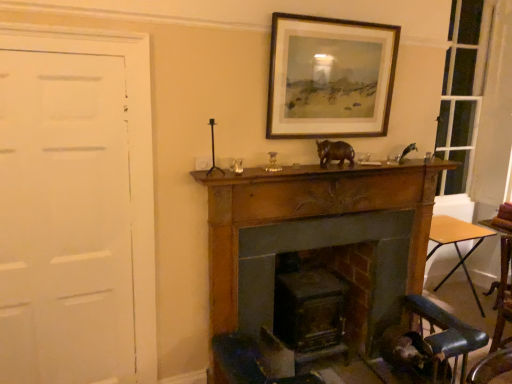
Question: Is white matte door at left with dark gray stone fireplace at center, acting as the first fireplace starting from the back?

Choices:
 (A) no
 (B) yes

Answer: (A)

Question: From the image's perspective, is white matte door at left over dark gray stone fireplace at center, acting as the first fireplace starting from the back?

Choices:
 (A) no
 (B) yes

Answer: (B)

Question: Is white matte door at left smaller than dark gray stone fireplace at center, which is the 2th fireplace from front to back?

Choices:
 (A) yes
 (B) no

Answer: (A)

Question: Is white matte door at left far away from dark gray stone fireplace at center, which is the 2th fireplace from front to back?

Choices:
 (A) yes
 (B) no

Answer: (A)

Question: Does white matte door at left have a greater height compared to dark gray stone fireplace at center, acting as the first fireplace starting from the back?

Choices:
 (A) no
 (B) yes

Answer: (B)

Question: From a real-world perspective, relative to dark gray stone fireplace at center, acting as the first fireplace starting from the back, is wooden folding table at lower right vertically above or below?

Choices:
 (A) below
 (B) above

Answer: (A)

Question: Based on their positions, is wooden folding table at lower right located to the left or right of dark gray stone fireplace at center, which is the 2th fireplace from front to back?

Choices:
 (A) left
 (B) right

Answer: (B)

Question: Is wooden folding table at lower right in front of or behind dark gray stone fireplace at center, acting as the first fireplace starting from the back, in the image?

Choices:
 (A) front
 (B) behind

Answer: (B)

Question: Considering the positions of wooden folding table at lower right and dark gray stone fireplace at center, acting as the first fireplace starting from the back, in the image, is wooden folding table at lower right bigger or smaller than dark gray stone fireplace at center, acting as the first fireplace starting from the back,?

Choices:
 (A) small
 (B) big

Answer: (A)

Question: Is point (333, 148) closer or farther from the camera than point (443, 225)?

Choices:
 (A) closer
 (B) farther

Answer: (A)

Question: From the image's perspective, relative to wooden at right, is brown matte rhino at center, the 2th animal when ordered from right to left, above or below?

Choices:
 (A) above
 (B) below

Answer: (A)

Question: Based on their sizes in the image, would you say brown matte rhino at center, acting as the 1th animal starting from the left, is bigger or smaller than wooden at right?

Choices:
 (A) small
 (B) big

Answer: (A)

Question: From a real-world perspective, is brown matte rhino at center, the 2th animal when ordered from right to left, above or below wooden at right?

Choices:
 (A) below
 (B) above

Answer: (B)

Question: Looking at the image, does metallic silver bird at upper right, which is the 1th animal in back-to-front order, seem bigger or smaller compared to wooden at right?

Choices:
 (A) small
 (B) big

Answer: (A)

Question: Considering the positions of metallic silver bird at upper right, which is the first animal from right to left, and wooden at right in the image, is metallic silver bird at upper right, which is the first animal from right to left, taller or shorter than wooden at right?

Choices:
 (A) tall
 (B) short

Answer: (B)